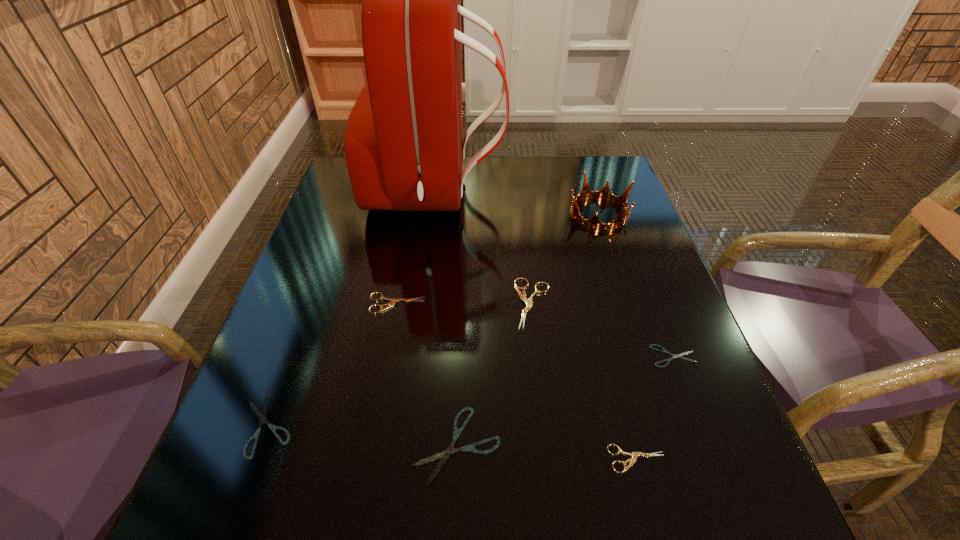
You are a GUI agent. You are given a task and a screenshot of the screen. Output one action in this format:
    pyautogui.click(x=<x>, y=<y>)
    Task: Click on the object located in the far left corner section of the desktop
    The image size is (960, 540).
    Given the screenshot: What is the action you would take?
    pyautogui.click(x=404, y=149)

This screenshot has height=540, width=960. Find the location of `object located in the far right corner section of the desktop`. object located in the far right corner section of the desktop is located at coordinates (605, 193).

Where is `free region at the far edge`? free region at the far edge is located at coordinates (505, 182).

At what (x,y) coordinates should I click in order to perform the action: click on vacant space at the left edge. Please return your answer as a coordinate pair (x, y). This screenshot has width=960, height=540. Looking at the image, I should click on (324, 221).

The image size is (960, 540). Identify the location of blank area at the right edge. (580, 204).

Identify the location of vacant space at the near right corner of the desktop. Image resolution: width=960 pixels, height=540 pixels. (736, 535).

Find the location of a particular element. The width and height of the screenshot is (960, 540). vacant region between the backpack and the farthest black shears is located at coordinates (555, 274).

Identify the location of free space between the biggest black shears and the leftmost object. This screenshot has height=540, width=960. (362, 435).

Identify the location of free point between the backpack and the shortest shears. (555, 274).

Locate an element on the screen. Image resolution: width=960 pixels, height=540 pixels. vacant point located between the third farthest shears and the leftmost black shears is located at coordinates (470, 391).